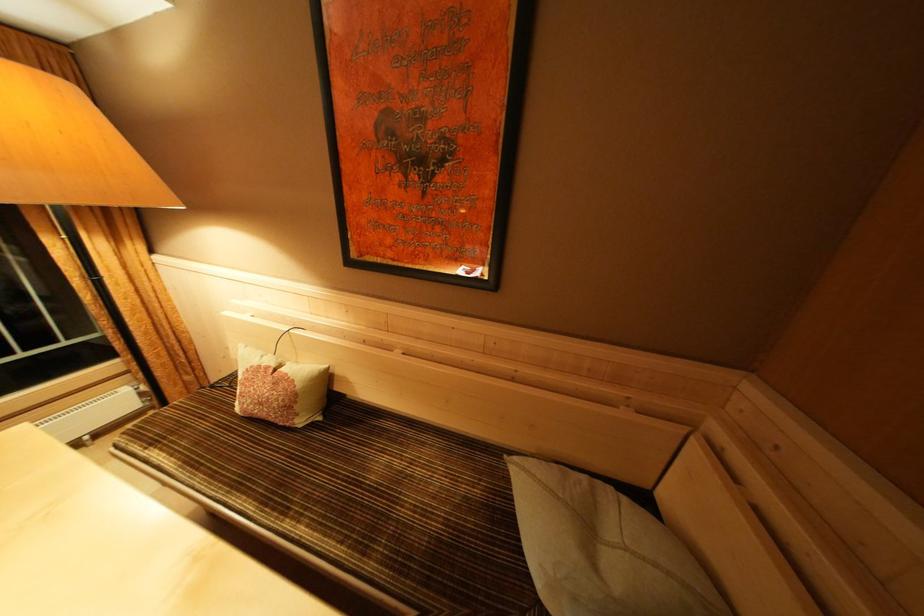
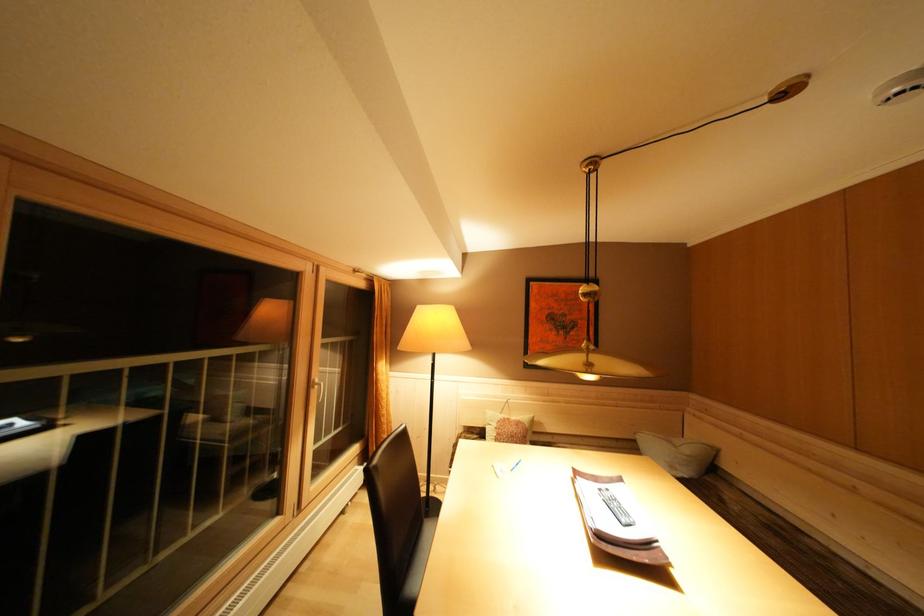
In the second image, find the point that corresponds to pixel 274 373 in the first image.

(515, 424)